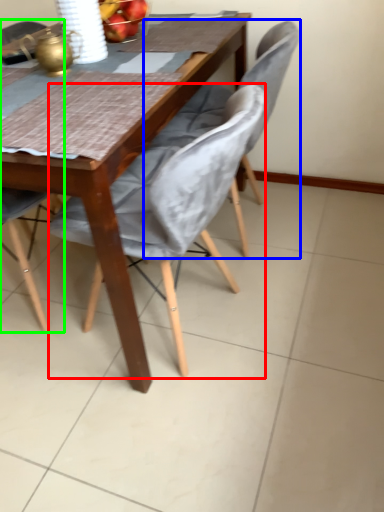
Question: Estimate the real-world distances between objects in this image. Which object is closer to chair (highlighted by a red box), chair (highlighted by a blue box) or chair (highlighted by a green box)?

Choices:
 (A) chair
 (B) chair

Answer: (A)